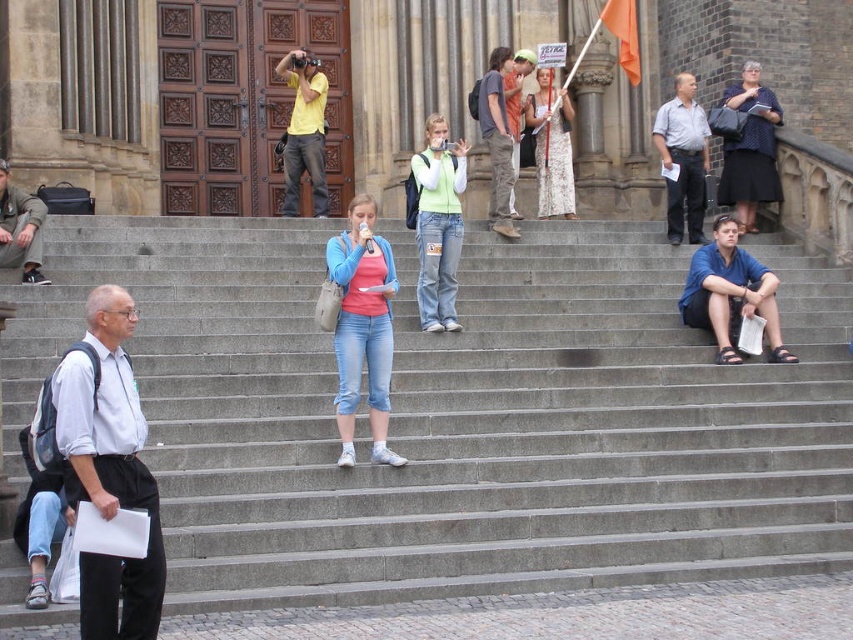
Between light green sweater at center and white lace dress at center, which one is positioned higher?

white lace dress at center is higher up.

What do you see at coordinates (438, 225) in the screenshot?
I see `light green sweater at center` at bounding box center [438, 225].

This screenshot has height=640, width=853. I want to click on light green sweater at center, so click(438, 225).

How far apart are blue cotton shirt at right and dark blue textured dress at upper right?

blue cotton shirt at right and dark blue textured dress at upper right are 11.26 meters apart.

Is blue cotton shirt at right positioned behind dark blue textured dress at upper right?

No.

Is point (746, 260) positioned before point (769, 141)?

Yes, it is in front of point (769, 141).

Where is `blue cotton shirt at right`? Image resolution: width=853 pixels, height=640 pixels. blue cotton shirt at right is located at coordinates (730, 294).

Which of these two, light green sweater at center or dark blue textured dress at upper right, stands taller?

light green sweater at center is taller.

Is light green sweater at center thinner than dark blue textured dress at upper right?

Incorrect, light green sweater at center's width is not less than dark blue textured dress at upper right's.

Locate an element on the screen. The height and width of the screenshot is (640, 853). light green sweater at center is located at coordinates (438, 225).